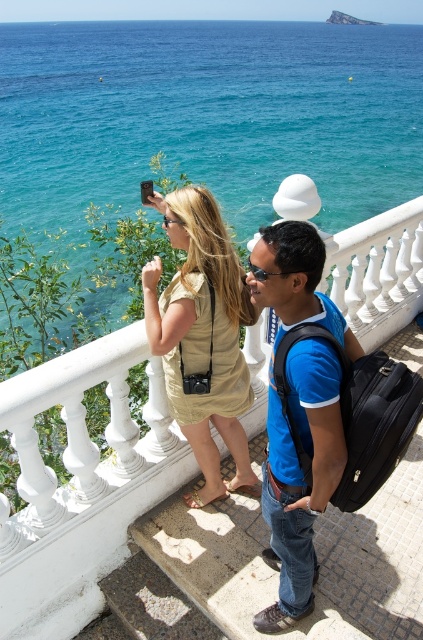
You are standing on the balcony and want to capture the blue water at upper center in your photo. Where should you position your camera to include it in the frame?

The blue water at upper center is located at point (208,115), so position your camera to aim towards that coordinate to include it in the frame.

You are a traveler who wants to take a photo of the scenic view from the balcony. You have a blue cotton shirt at center and a black fabric backpack at center. Which item is blocking your view when standing in the center?

The blue cotton shirt at center is in front of the black fabric backpack at center, so the blue cotton shirt at center is blocking the view.

You are a fashion designer observing the scene and want to create a new collection inspired by the items at the center. Which item has a greater width, the matte gold dress at center or the black fabric backpack at center?

The matte gold dress at center has a greater width than the black fabric backpack at center.